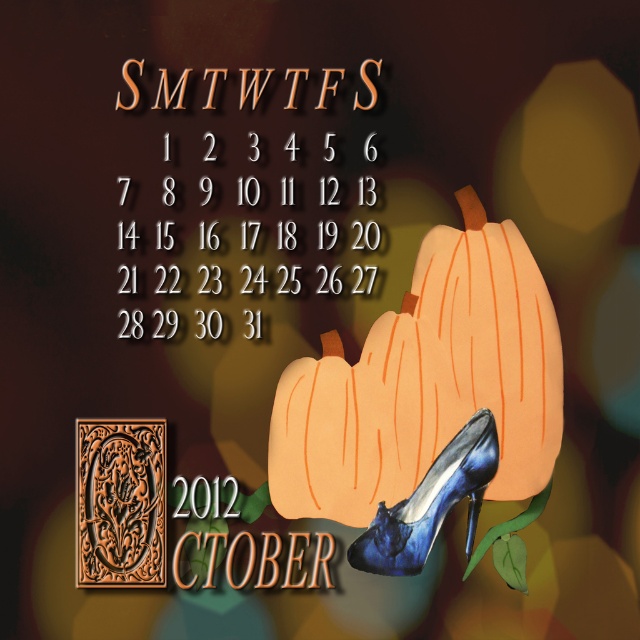
Does orange matte pumpkin at center come in front of blue satin high-heeled shoe at lower center?

No.

Who is lower down, orange matte pumpkin at center or blue satin high-heeled shoe at lower center?

Positioned lower is blue satin high-heeled shoe at lower center.

Between point (497, 356) and point (368, 568), which one is positioned in front?

Point (368, 568) is in front.

Identify the location of orange matte pumpkin at center. (426, 381).